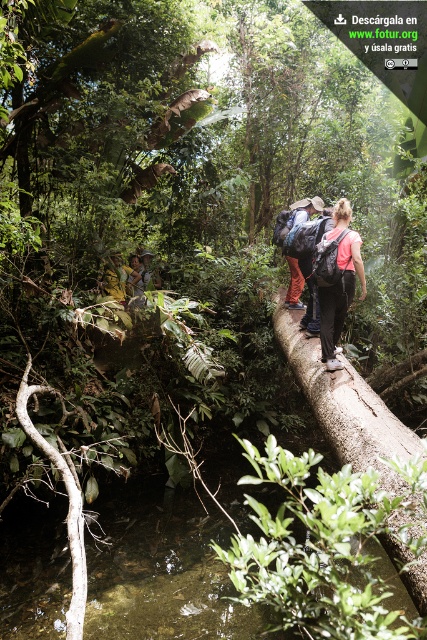
Question: Which point is closer to the camera taking this photo?

Choices:
 (A) (409, 572)
 (B) (321, 204)
 (C) (336, 232)

Answer: (A)

Question: Which of the following is the farthest from the observer?

Choices:
 (A) (344, 376)
 (B) (318, 269)
 (C) (306, 212)

Answer: (C)

Question: Where is pink fabric backpack at center located in relation to matte brown backpack at center in the image?

Choices:
 (A) below
 (B) above

Answer: (A)

Question: Can you confirm if pink fabric backpack at center is bigger than matte brown backpack at center?

Choices:
 (A) no
 (B) yes

Answer: (B)

Question: Which of these objects is positioned closest to the pink fabric backpack at center?

Choices:
 (A) brown rough tree trunk at center
 (B) matte brown backpack at center

Answer: (A)

Question: Is brown rough tree trunk at center further to the viewer compared to matte brown backpack at center?

Choices:
 (A) yes
 (B) no

Answer: (B)